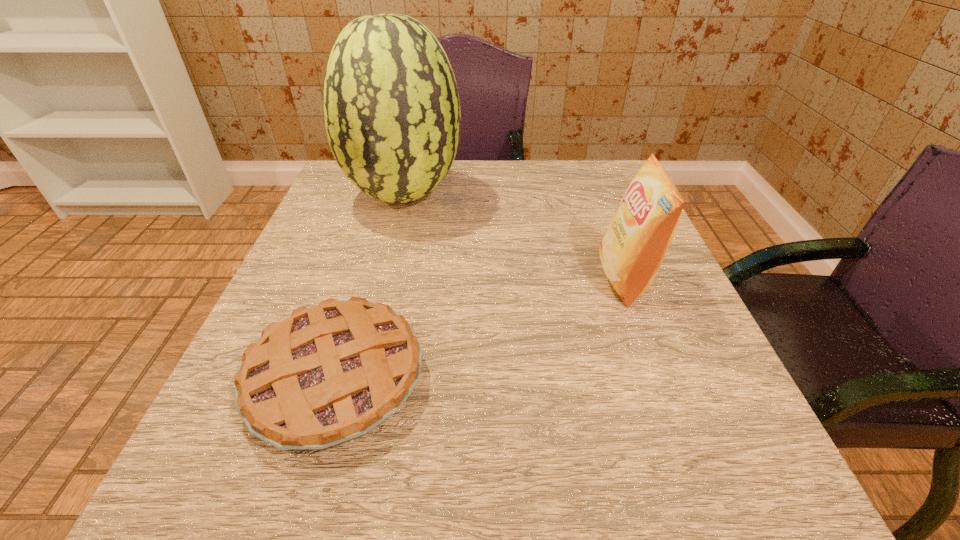
You are a GUI agent. You are given a task and a screenshot of the screen. Output one action in this format:
    pyautogui.click(x=<x>, y=<y>)
    Task: Click on the free space at the left edge
    The image size is (960, 540).
    Given the screenshot: What is the action you would take?
    pyautogui.click(x=281, y=321)

Where is `free space at the right edge`? This screenshot has width=960, height=540. free space at the right edge is located at coordinates (644, 441).

Find the location of a particular element. The height and width of the screenshot is (540, 960). blank space at the far left corner of the desktop is located at coordinates (352, 184).

Identify the location of vacant region at the far right corner. The height and width of the screenshot is (540, 960). (606, 163).

Locate an element on the screen. This screenshot has height=540, width=960. vacant region between the shortest object and the crisp (potato chip) is located at coordinates (481, 329).

Locate an element on the screen. The width and height of the screenshot is (960, 540). free space between the farthest object and the nearest object is located at coordinates (371, 287).

The image size is (960, 540). Find the location of `vacant area that lies between the shortest object and the farthest object`. vacant area that lies between the shortest object and the farthest object is located at coordinates (371, 287).

Locate an element on the screen. vacant space that's between the farthest object and the pie is located at coordinates (371, 287).

Identify the location of unoccupied position between the shortest object and the second shortest object. (481, 329).

Find the location of a particular element. This screenshot has width=960, height=540. vacant point located between the nearest object and the farthest object is located at coordinates (371, 287).